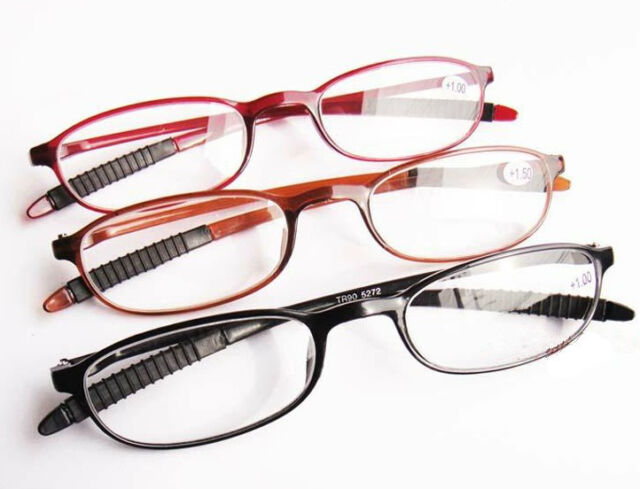
I want to click on hinges, so click(x=61, y=363), click(x=593, y=243), click(x=59, y=237).